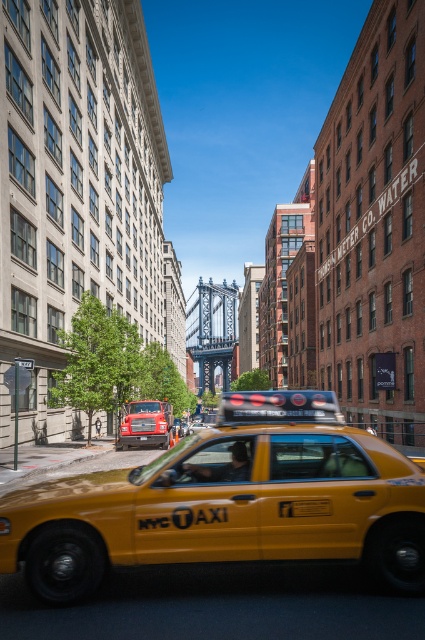
Question: Does yellow matte taxi at center come behind yellow matte taxi cab at center?

Choices:
 (A) yes
 (B) no

Answer: (B)

Question: Which of the following is the farthest from the observer?

Choices:
 (A) (158, 484)
 (B) (187, 428)

Answer: (B)

Question: Does yellow matte taxi at center have a lesser width compared to yellow matte taxi cab at center?

Choices:
 (A) yes
 (B) no

Answer: (B)

Question: Is yellow rubber nyc taxi at center thinner than yellow matte taxi cab at center?

Choices:
 (A) yes
 (B) no

Answer: (A)

Question: Which object is closer to the camera taking this photo?

Choices:
 (A) yellow matte taxi at center
 (B) yellow rubber nyc taxi at center
 (C) yellow matte taxi cab at center

Answer: (A)

Question: Which object is positioned closest to the yellow matte taxi at center?

Choices:
 (A) yellow matte taxi cab at center
 (B) yellow rubber nyc taxi at center

Answer: (A)